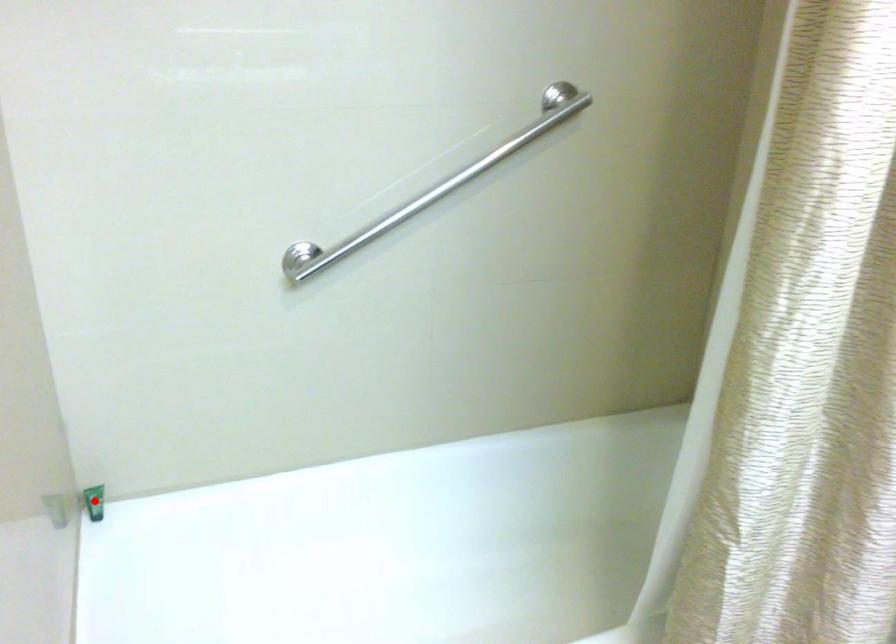
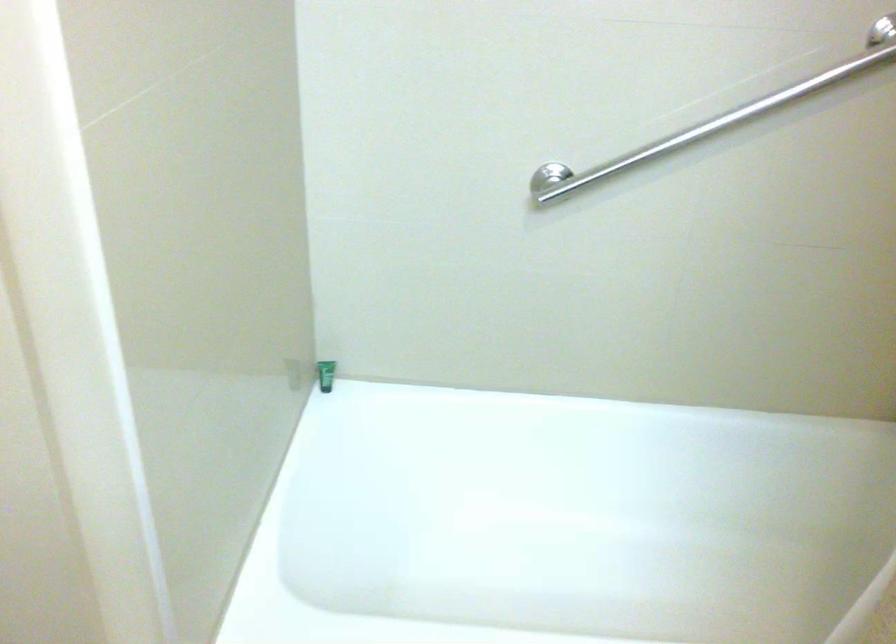
Question: I am providing you with two images of the same scene from different viewpoints. A red point is marked on the first image. Can you still see the location of the red point in image 2?

Choices:
 (A) Yes
 (B) No

Answer: (A)